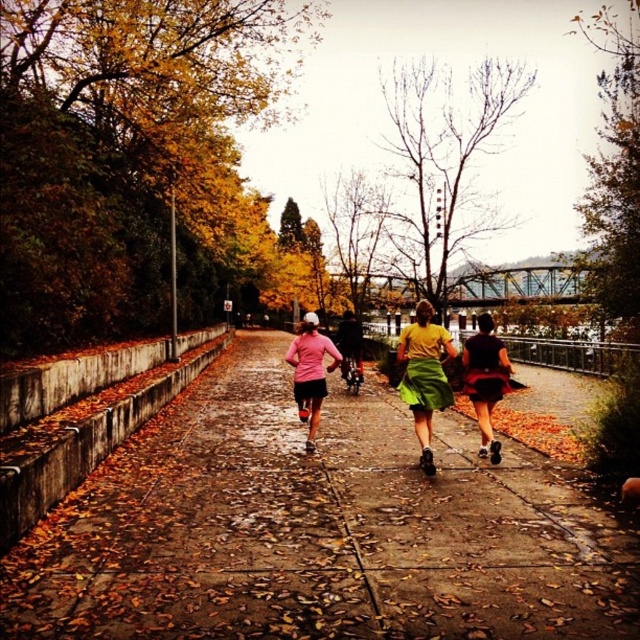
Can you confirm if concrete at center is taller than matte black shorts at center?

Incorrect, concrete at center's height is not larger of matte black shorts at center's.

Is concrete at center behind matte black shorts at center?

No.

Is point (349, 518) positioned in front of point (474, 371)?

Yes, it is.

You are a GUI agent. You are given a task and a screenshot of the screen. Output one action in this format:
    pyautogui.click(x=<x>, y=<y>)
    Task: Click on the concrete at center
    
    Given the screenshot: What is the action you would take?
    (316, 531)

Is concrete at center behind yellow matte shirt at center?

No, it is not.

Image resolution: width=640 pixels, height=640 pixels. I want to click on concrete at center, so click(316, 531).

In the scene shown: Does concrete at center lie behind pink matte shirt at center?

No, concrete at center is closer to the viewer.

Does concrete at center have a smaller size compared to pink matte shirt at center?

Indeed, concrete at center has a smaller size compared to pink matte shirt at center.

Which is in front, point (417, 636) or point (300, 358)?

Point (417, 636)

I want to click on concrete at center, so pos(316,531).